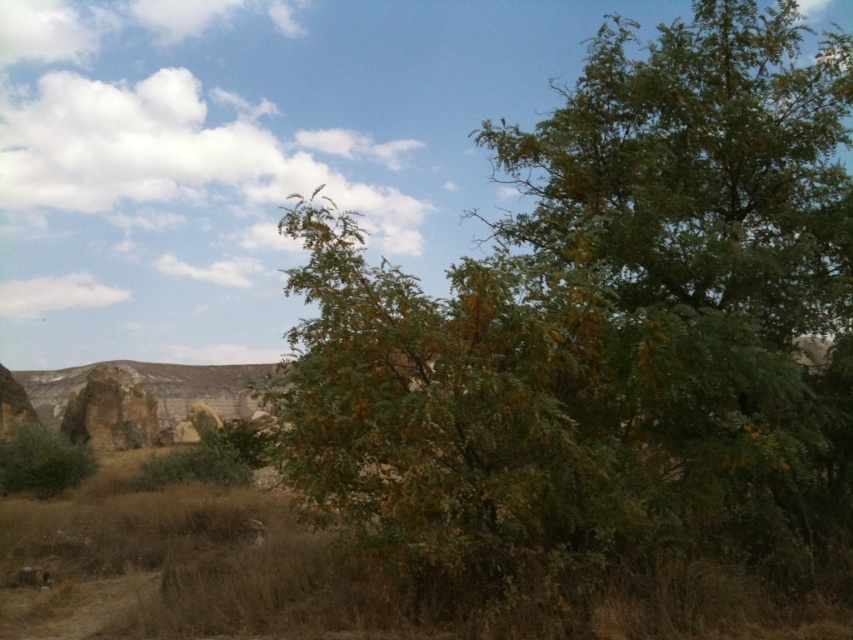
You are standing in the natural landscape and want to place a small garden ornament between the rustic stone rock formation at left and the green leafy bush at lower left. Based on their positions, where should you position the ornament to ensure it is between both objects?

The rustic stone rock formation at left is located below the green leafy bush at lower left, so placing the ornament between them would require positioning it above the rustic stone rock formation at left and below the green leafy bush at lower left.

You are a hiker trying to navigate through the landscape shown. You need to move from the rustic stone rock formation at left to the green leafy tree at center. Which direction should you head to reach the tree?

The green leafy tree at center is positioned on the right side of rustic stone rock formation at left, so you should head to the right to reach the tree.